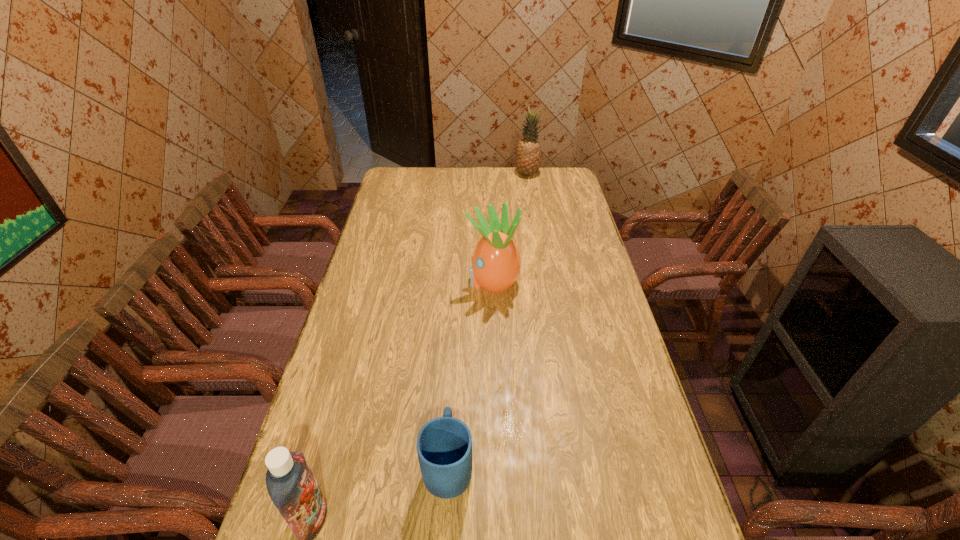
Where is `free space located on the side of the mug with the handle`? Image resolution: width=960 pixels, height=540 pixels. free space located on the side of the mug with the handle is located at coordinates (452, 403).

At what (x,y) coordinates should I click in order to perform the action: click on vacant region located 0.170m on the side of the mug with the handle. Please return your answer as a coordinate pair (x, y). Looking at the image, I should click on (453, 380).

Find the location of a particular element. object located at the far edge is located at coordinates (528, 152).

This screenshot has width=960, height=540. In order to click on object positioned at the right edge in this screenshot , I will do `click(528, 152)`.

Identify the location of object at the far right corner. This screenshot has width=960, height=540. (528, 152).

Locate an element on the screen. vacant area at the far edge of the desktop is located at coordinates (436, 185).

Identify the location of vacant region at the left edge of the desktop. (342, 536).

This screenshot has height=540, width=960. What are the coordinates of `free space at the right edge` in the screenshot? It's located at (647, 495).

Find the location of a particular element. The image size is (960, 540). unoccupied area between the shortest object and the nearer pineapple is located at coordinates (470, 373).

Where is `free area in between the mug and the nearer pineapple`? free area in between the mug and the nearer pineapple is located at coordinates (470, 373).